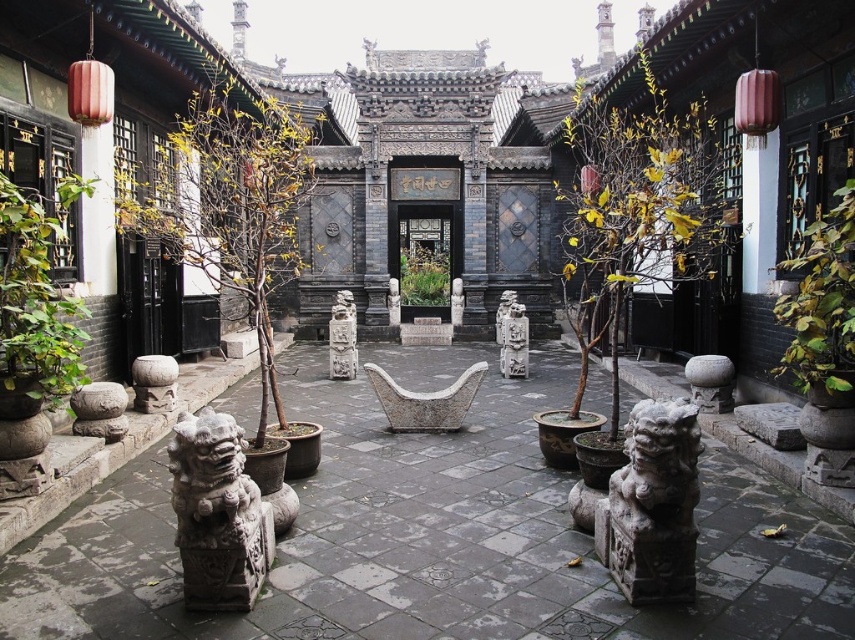
You are a visitor in the courtyard and want to take a photo of both the brown bark tree at center and the green leafy plant at right. Which object should you focus on first if you want to capture both in the same frame without moving your camera?

The brown bark tree at center might be wider than the green leafy plant at right, so you should focus on the brown bark tree at center first to ensure it fits in the frame.

You are an architect planning to place a new decorative element in the courtyard. The new element requires a space wider than the gray stone lion at center. Can the space occupied by the gray stone statue at center accommodate this requirement?

The gray stone statue at center has a greater width than the gray stone lion at center. Therefore, the space occupied by the gray stone statue at center can accommodate the new decorative element requiring a space wider than the gray stone lion at center.